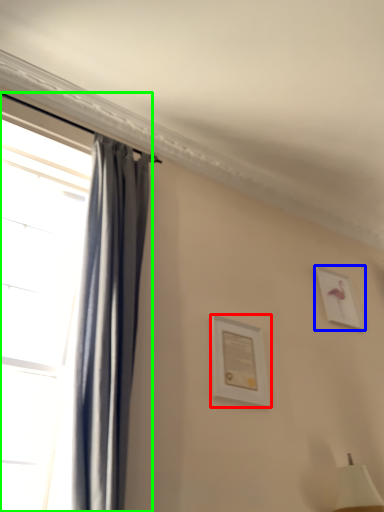
Question: Which is nearer to the picture frame (highlighted by a red box)? picture frame (highlighted by a blue box) or window (highlighted by a green box).

Choices:
 (A) picture frame
 (B) window

Answer: (B)